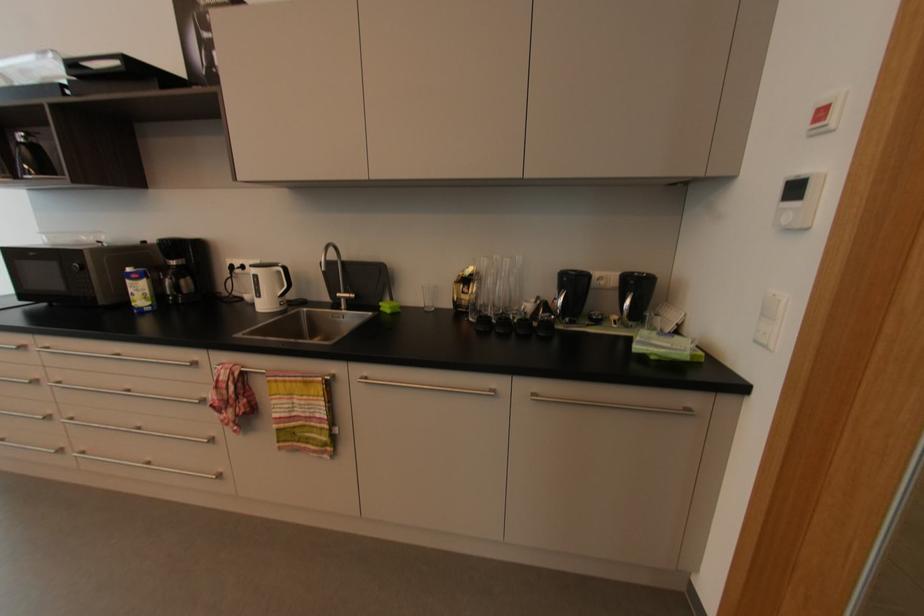
Find where to press the red wall button. Please return your answer as a coordinate pair (x, y).

(825, 113)